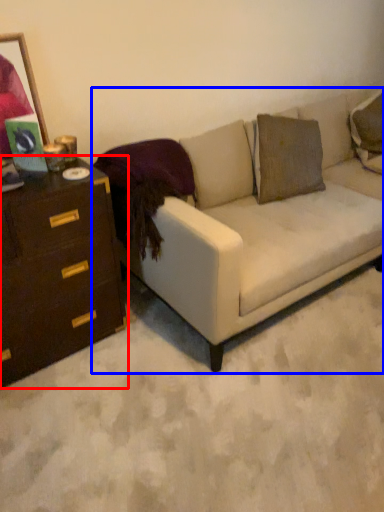
Question: Which object appears farthest to the camera in this image, chest of drawers (highlighted by a red box) or studio couch (highlighted by a blue box)?

Choices:
 (A) chest of drawers
 (B) studio couch

Answer: (B)